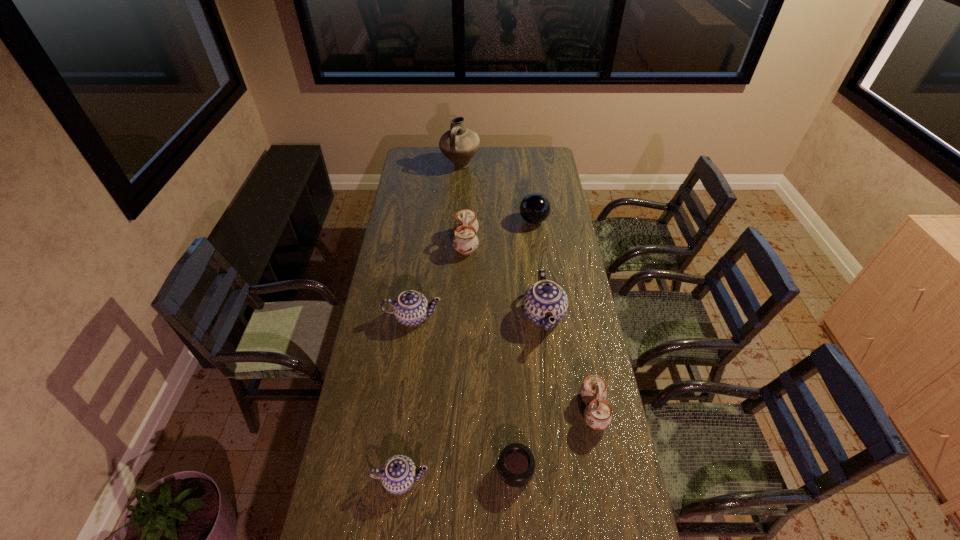
I want to click on vacant space located by the handle of the sixth farthest object, so tap(481, 410).

Identify the location of vacant space located 0.260m by the handle of the sixth farthest object. point(505,410).

The width and height of the screenshot is (960, 540). I want to click on vacant space located 0.150m by the handle of the sixth farthest object, so click(537, 410).

You are a GUI agent. You are given a task and a screenshot of the screen. Output one action in this format:
    pyautogui.click(x=<x>, y=<y>)
    Task: Click on the free region located 0.110m at the spout of the nearest blue chinaware
    Image resolution: width=960 pixels, height=540 pixels.
    Given the screenshot: What is the action you would take?
    pyautogui.click(x=394, y=539)

You are a GUI agent. You are given a task and a screenshot of the screen. Output one action in this format:
    pyautogui.click(x=<x>, y=<y>)
    Task: Click on the free region located 0.250m on the side of the shortest object with brand markings and control switches
    
    Given the screenshot: What is the action you would take?
    pyautogui.click(x=417, y=470)

The height and width of the screenshot is (540, 960). Find the location of `free point located 0.140m on the side of the shortest object with brand markings and control switches`. free point located 0.140m on the side of the shortest object with brand markings and control switches is located at coordinates (452, 470).

Where is `vacant region located on the side of the shortest object with brand markings and control switches`? The width and height of the screenshot is (960, 540). vacant region located on the side of the shortest object with brand markings and control switches is located at coordinates (372, 470).

Identify the location of object located in the far edge section of the desktop. (459, 144).

Identify the location of bowling ball situated at the right edge. (535, 208).

In order to click on free space at the far edge in this screenshot , I will do `click(500, 152)`.